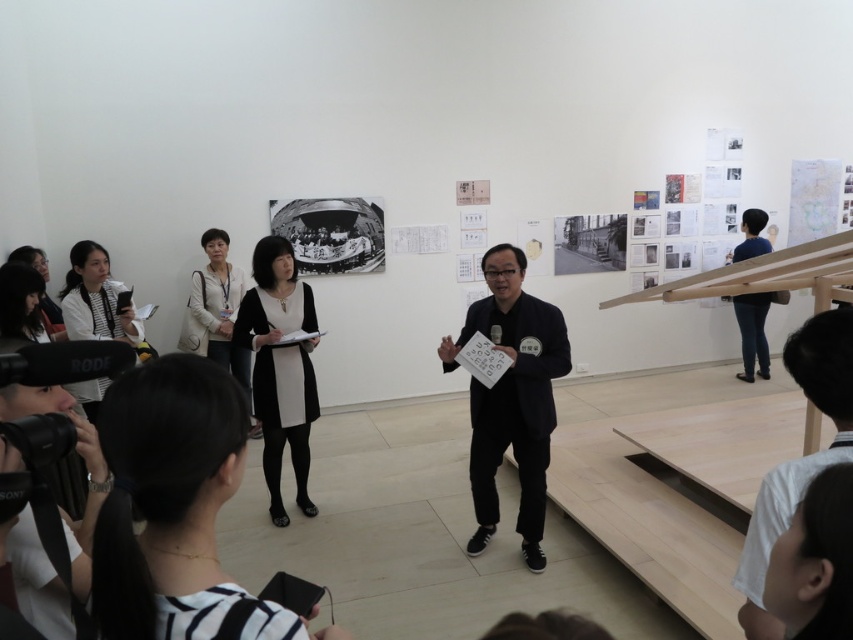
You are an attendee at the event and want to approach the presenter who is wearing the black matte shirt at center and blue jeans at right. Which piece of clothing should you look for first as you face the presenter?

The black matte shirt at center is positioned on the left side of blue jeans at right, so you should look for the black matte shirt at center first as it is on the left side when facing the presenter.

You are an attendee at the event and want to approach the presenter. The presenter is wearing a black matte shirt at center and blue jeans at right. Which part of their clothing should you look at first to locate them?

The black matte shirt at center is located below blue jeans at right, so you should look at the blue jeans at right first since it is positioned higher up.

Looking at this image, you are an attendee at the event and want to take a photo of both the black matte dress at lower left and the light beige sweater at center. Which one should you focus on first to ensure both are in the frame?

The black matte dress at lower left is positioned on the right side of light beige sweater at center, so you should focus on the light beige sweater at center first to ensure both are in the frame.